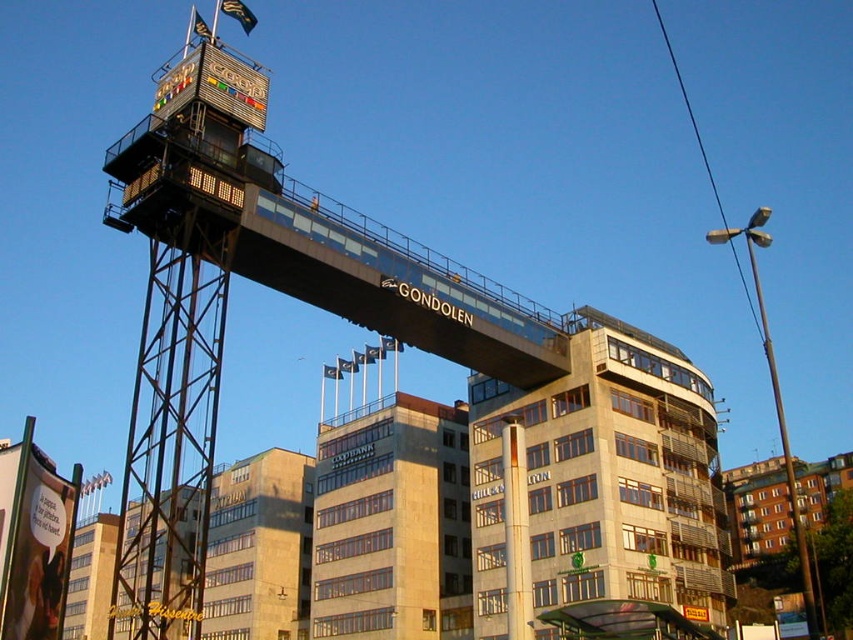
Question: Among these points, which one is nearest to the camera?

Choices:
 (A) (392, 412)
 (B) (138, 451)
 (C) (584, 474)
 (D) (422, 298)

Answer: (B)

Question: In this image, where is beige concrete building at center located relative to metallic gondola at upper center?

Choices:
 (A) left
 (B) right

Answer: (B)

Question: Which point appears closest to the camera in this image?

Choices:
 (A) (142, 596)
 (B) (318, 221)

Answer: (B)

Question: Does beige stone building at center have a larger size compared to metallic glass bridge at center?

Choices:
 (A) yes
 (B) no

Answer: (A)

Question: Estimate the real-world distances between objects in this image. Which object is closer to the metallic glass bridge at center?

Choices:
 (A) beige stone building at center
 (B) metallic gondola at upper center

Answer: (A)

Question: Observing the image, what is the correct spatial positioning of metallic gondola at upper center in reference to beige stone building at center?

Choices:
 (A) left
 (B) right

Answer: (A)